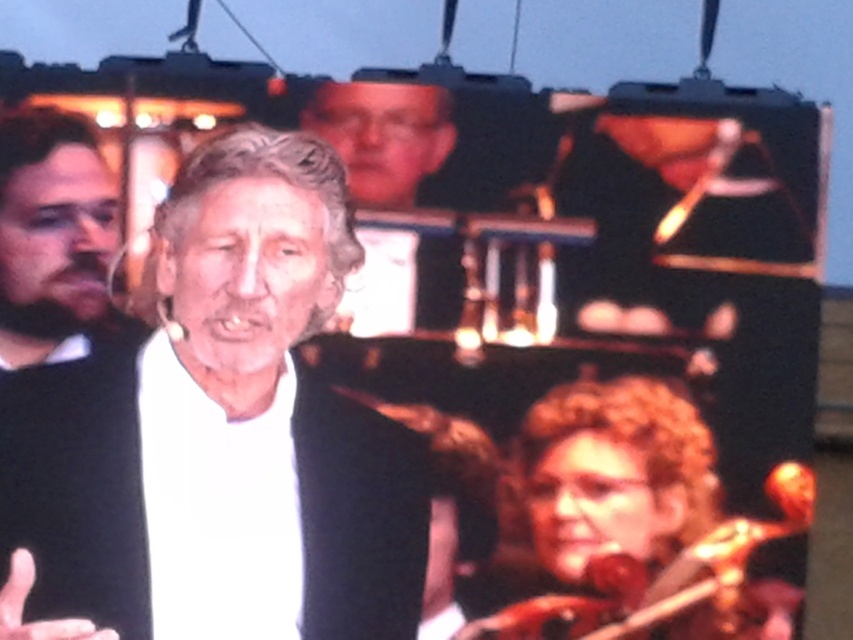
You are a photographer at the event and want to capture a closeup of the curly blonde hair at lower right without the white matte hand at lower left blocking it. Based on their positions, is this possible?

The curly blonde hair at lower right is positioned under the white matte hand at lower left, so moving the camera angle slightly upward might allow capturing the curly blonde hair at lower right without the hand blocking it.

You are a photographer standing at the camera position. You want to capture a closeup shot of the curly blonde hair at lower right. Given that your zoom lens can focus as close as 3 meters, will you be able to achieve this without moving closer?

The distance between curly blonde hair at lower right and the camera is 4.09 meters. Since your zoom lens can focus as close as 3 meters, you need to move 1.09 meters closer to be within the minimum focusing distance.

You are an audience member sitting in the front row of the concert hall. You notice the white matte shirt at center and the black matte sweater at left. Which one is closer to you?

The white matte shirt at center is closer to you since it is in front of the black matte sweater at left.